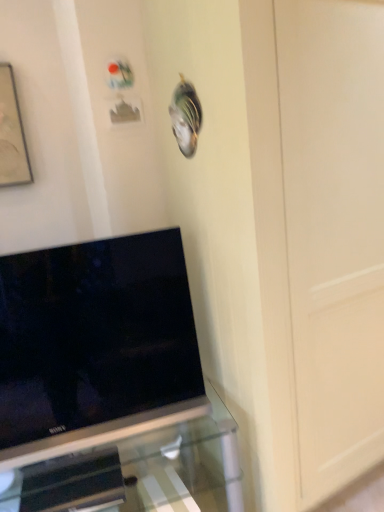
Question: From the image's perspective, is matte black picture frame at upper left below transparent glass tv stand at lower left?

Choices:
 (A) yes
 (B) no

Answer: (B)

Question: Considering the relative positions of matte black picture frame at upper left and transparent glass tv stand at lower left in the image provided, is matte black picture frame at upper left behind transparent glass tv stand at lower left?

Choices:
 (A) no
 (B) yes

Answer: (B)

Question: From a real-world perspective, is matte black picture frame at upper left over transparent glass tv stand at lower left?

Choices:
 (A) yes
 (B) no

Answer: (A)

Question: Considering the relative positions of matte black picture frame at upper left and transparent glass tv stand at lower left in the image provided, is matte black picture frame at upper left to the left of transparent glass tv stand at lower left from the viewer's perspective?

Choices:
 (A) yes
 (B) no

Answer: (A)

Question: Does matte black picture frame at upper left have a greater width compared to transparent glass tv stand at lower left?

Choices:
 (A) yes
 (B) no

Answer: (B)

Question: Is matte black picture frame at upper left far away from transparent glass tv stand at lower left?

Choices:
 (A) no
 (B) yes

Answer: (B)

Question: Is the position of matte black picture frame at upper left more distant than that of black glossy tv at lower left?

Choices:
 (A) yes
 (B) no

Answer: (A)

Question: Can you confirm if matte black picture frame at upper left is positioned to the right of black glossy tv at lower left?

Choices:
 (A) yes
 (B) no

Answer: (B)

Question: Is matte black picture frame at upper left shorter than black glossy tv at lower left?

Choices:
 (A) no
 (B) yes

Answer: (B)

Question: Is matte black picture frame at upper left thinner than black glossy tv at lower left?

Choices:
 (A) yes
 (B) no

Answer: (A)

Question: From the image's perspective, is matte black picture frame at upper left below black glossy tv at lower left?

Choices:
 (A) yes
 (B) no

Answer: (B)

Question: From a real-world perspective, is matte black picture frame at upper left physically above black glossy tv at lower left?

Choices:
 (A) no
 (B) yes

Answer: (B)

Question: From a real-world perspective, is black glossy tv at lower left below matte black picture frame at upper left?

Choices:
 (A) no
 (B) yes

Answer: (B)